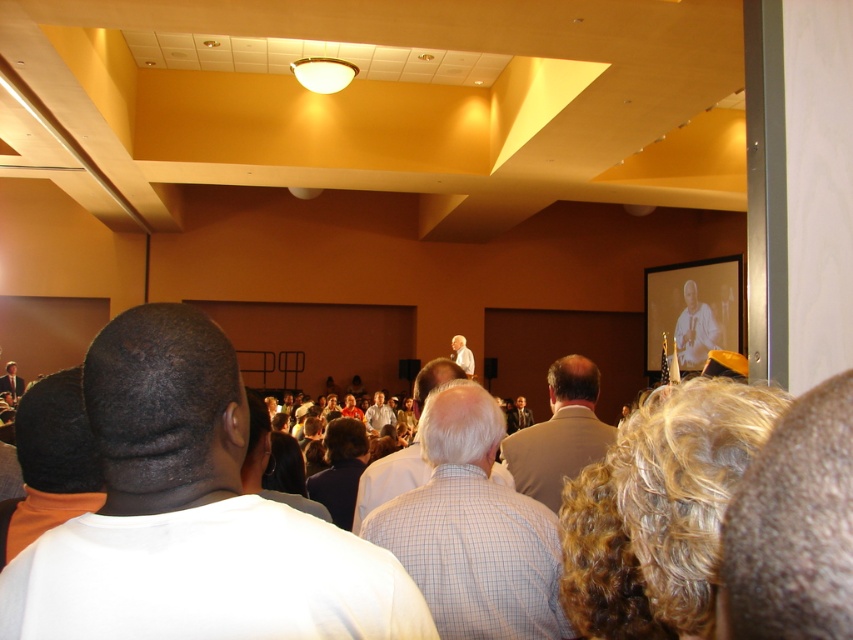
Looking at this image, does white checkered shirt at center have a smaller size compared to dark brown hair at center?

Correct, white checkered shirt at center occupies less space than dark brown hair at center.

Can you confirm if white checkered shirt at center is taller than dark brown hair at center?

Indeed, white checkered shirt at center has a greater height compared to dark brown hair at center.

I want to click on white checkered shirt at center, so click(389, 480).

This screenshot has height=640, width=853. What are the coordinates of `white checkered shirt at center` in the screenshot? It's located at (389, 480).

Is light brown suit at center thinner than dark brown hair at center?

Incorrect, light brown suit at center's width is not less than dark brown hair at center's.

Is light brown suit at center taller than dark brown hair at center?

Correct, light brown suit at center is much taller as dark brown hair at center.

The width and height of the screenshot is (853, 640). What are the coordinates of `light brown suit at center` in the screenshot? It's located at (560, 433).

Who is taller, light blue checkered shirt at center or light brown shirt at center?

Standing taller between the two is light blue checkered shirt at center.

Is point (419, 531) closer to viewer compared to point (376, 390)?

Yes, point (419, 531) is closer to viewer.

The height and width of the screenshot is (640, 853). Describe the element at coordinates (473, 529) in the screenshot. I see `light blue checkered shirt at center` at that location.

You are a GUI agent. You are given a task and a screenshot of the screen. Output one action in this format:
    pyautogui.click(x=<x>, y=<y>)
    Task: Click on the light blue checkered shirt at center
    
    Given the screenshot: What is the action you would take?
    pyautogui.click(x=473, y=529)